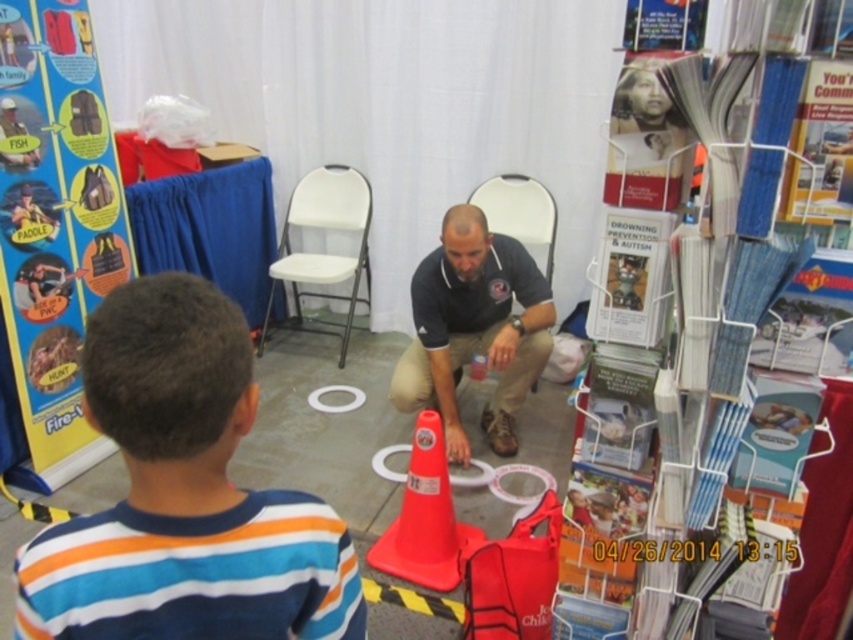
You are a photographer trying to capture a photo of the striped cotton shirt at lower left and the matte black chair at center. Since you want to ensure both are in focus, you need to know which object is shorter. Which one is shorter?

The striped cotton shirt at lower left has a lesser height compared to the matte black chair at center, so the striped cotton shirt at lower left is shorter.

Looking at the scene, which object is positioned to the left of the other between the striped cotton shirt at lower left and the matte black shirt at center?

The striped cotton shirt at lower left is positioned to the left of the matte black shirt at center.

You are standing at the point marked by the coordinates point (184, 493). Looking towards the striped cotton shirt at lower left, which direction should you move to get closer to it?

Since the striped cotton shirt at lower left is represented by point (184, 493), you are already at the same location as the striped cotton shirt at lower left. Therefore, you don not need to move in any direction to get closer.